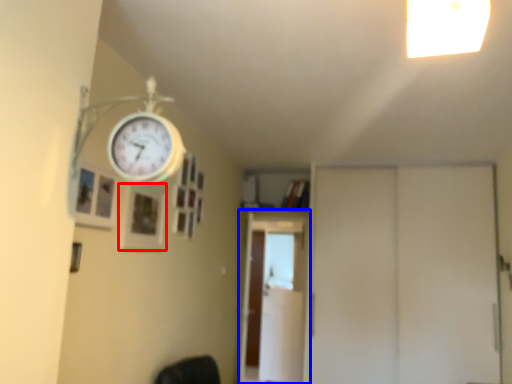
Question: Which object appears farthest to the camera in this image, picture frame (highlighted by a red box) or screen door (highlighted by a blue box)?

Choices:
 (A) picture frame
 (B) screen door

Answer: (B)